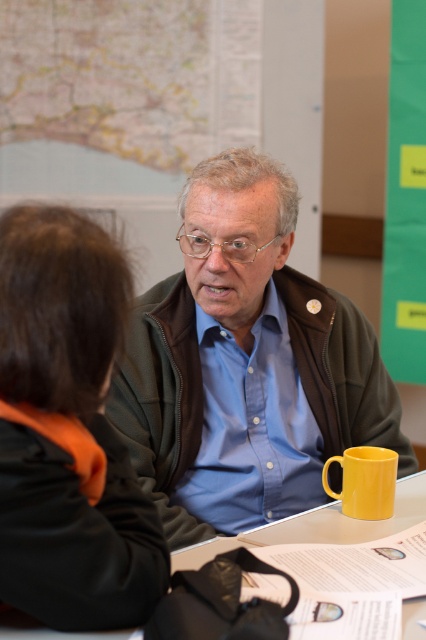
You are helping a customer choose between two jackets in a store. The customer wants to know which jacket is wider. The options are the matte brown jacket at center and the black fabric jacket at lower left. Based on the image, which one should they choose?

The matte brown jacket at center is wider than the black fabric jacket at lower left, so they should choose the matte brown jacket at center.

You are organizing a small event and need to place a decorative item on a table. The table has limited space, and you want to ensure the item fits. You have the matte brown jacket at center and the yellow matte mug at lower right. Which item should you choose to place on the table to maximize space efficiency?

The yellow matte mug at lower right is smaller than the matte brown jacket at center, so choosing the yellow matte mug at lower right would allow for better space efficiency on the table.